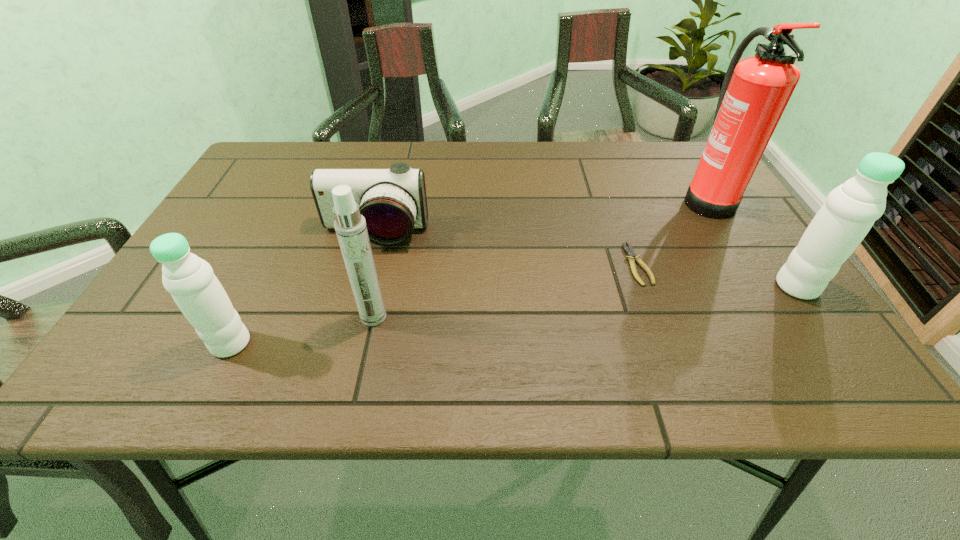
Please point a location where one more water_bottle can be added evenly. Please provide its 2D coordinates. Your answer should be formatted as a tuple, i.e. [(x, y)], where the tuple contains the x and y coordinates of a point satisfying the conditions above.

[(531, 313)]